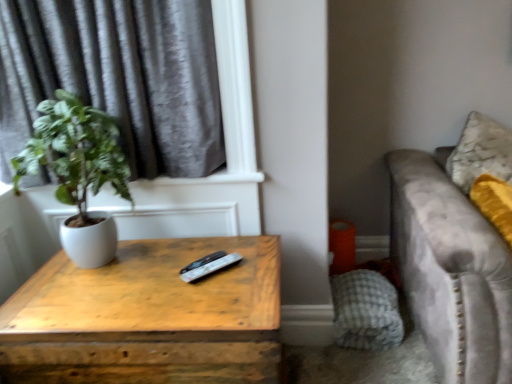
Image resolution: width=512 pixels, height=384 pixels. Find the location of `free space to the left of black plastic remote at center`. free space to the left of black plastic remote at center is located at coordinates (149, 273).